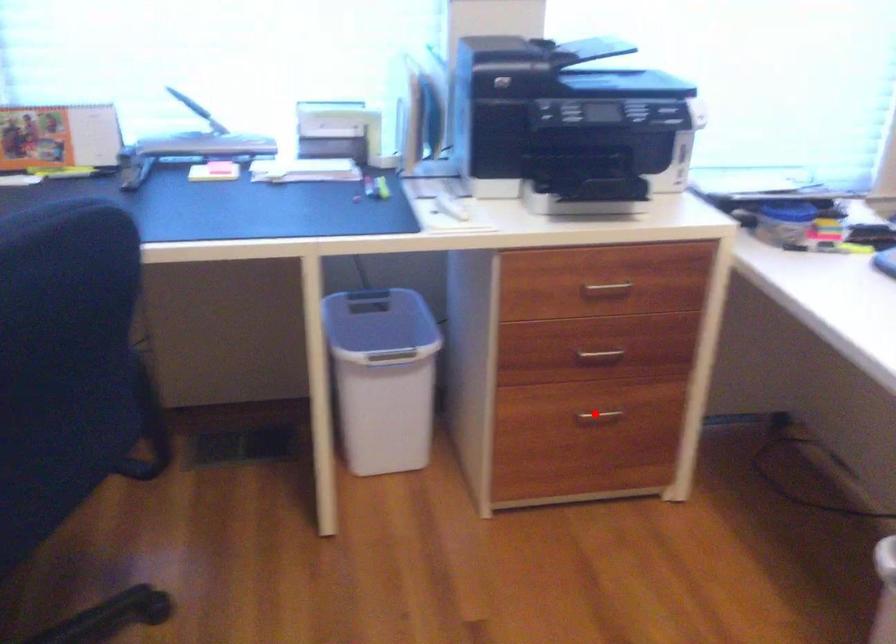
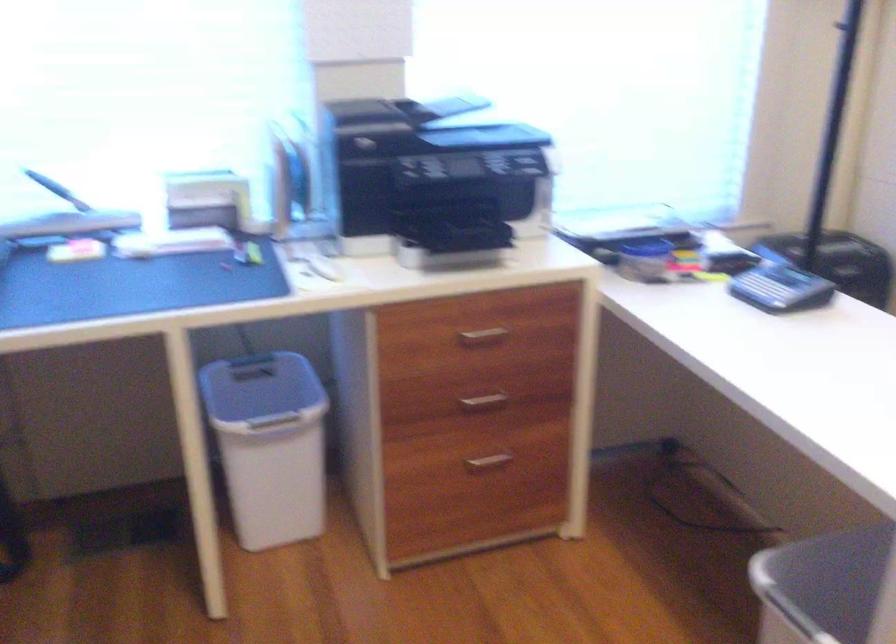
In the second image, find the point that corresponds to the highlighted location in the first image.

(487, 462)